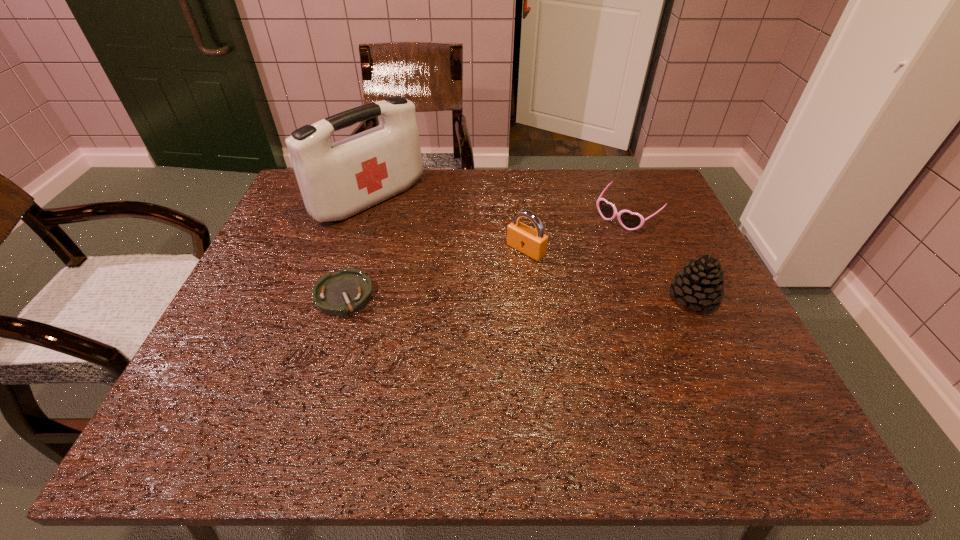
At what (x,y) coordinates should I click in order to perform the action: click on sunglasses that is positioned at the far edge. Please return your answer as a coordinate pair (x, y). Image resolution: width=960 pixels, height=540 pixels. Looking at the image, I should click on (629, 220).

Identify the location of object situated at the left edge. (337, 180).

Identify the location of pinecone located at the right edge. (700, 284).

The image size is (960, 540). I want to click on sunglasses that is at the right edge, so click(629, 220).

The height and width of the screenshot is (540, 960). I want to click on object that is at the far left corner, so click(x=337, y=180).

Where is `object positioned at the far right corner`? object positioned at the far right corner is located at coordinates (629, 220).

Locate an element on the screen. vacant space at the far edge of the desktop is located at coordinates (564, 188).

In the image, there is a desktop. Where is `vacant space at the near edge`? This screenshot has height=540, width=960. vacant space at the near edge is located at coordinates (665, 361).

Identify the location of free region at the left edge of the desktop. The height and width of the screenshot is (540, 960). (300, 268).

In order to click on free spot at the right edge of the desktop in this screenshot , I will do `click(690, 261)`.